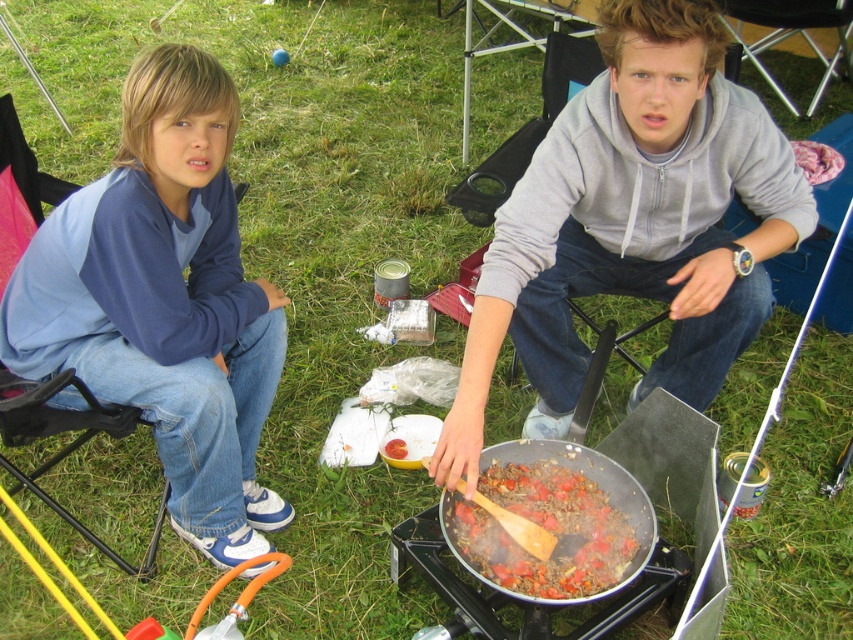
Who is shorter, gray hoodie at center or brown matte wooden spoon at center?

With less height is brown matte wooden spoon at center.

Is gray hoodie at center taller than brown matte wooden spoon at center?

Yes, gray hoodie at center is taller than brown matte wooden spoon at center.

This screenshot has height=640, width=853. Describe the element at coordinates (631, 225) in the screenshot. I see `gray hoodie at center` at that location.

Find the location of a particular element. The height and width of the screenshot is (640, 853). gray hoodie at center is located at coordinates (631, 225).

Which of these two, blue cotton sweatshirt at left or brown matte wooden spoon at center, stands taller?

blue cotton sweatshirt at left

Who is positioned more to the left, blue cotton sweatshirt at left or brown matte wooden spoon at center?

From the viewer's perspective, blue cotton sweatshirt at left appears more on the left side.

The width and height of the screenshot is (853, 640). What do you see at coordinates (164, 301) in the screenshot?
I see `blue cotton sweatshirt at left` at bounding box center [164, 301].

At what (x,y) coordinates should I click in order to perform the action: click on blue cotton sweatshirt at left. Please return your answer as a coordinate pair (x, y). The height and width of the screenshot is (640, 853). Looking at the image, I should click on (164, 301).

In the scene shown: Does gray hoodie at center have a greater height compared to blue cotton sweatshirt at left?

Incorrect, gray hoodie at center's height is not larger of blue cotton sweatshirt at left's.

Locate an element on the screen. This screenshot has height=640, width=853. gray hoodie at center is located at coordinates (631, 225).